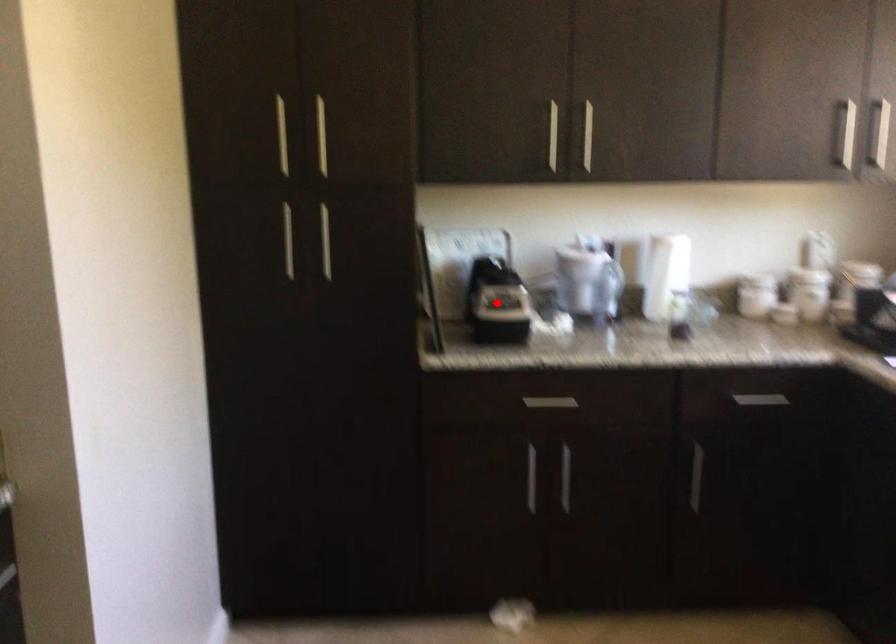
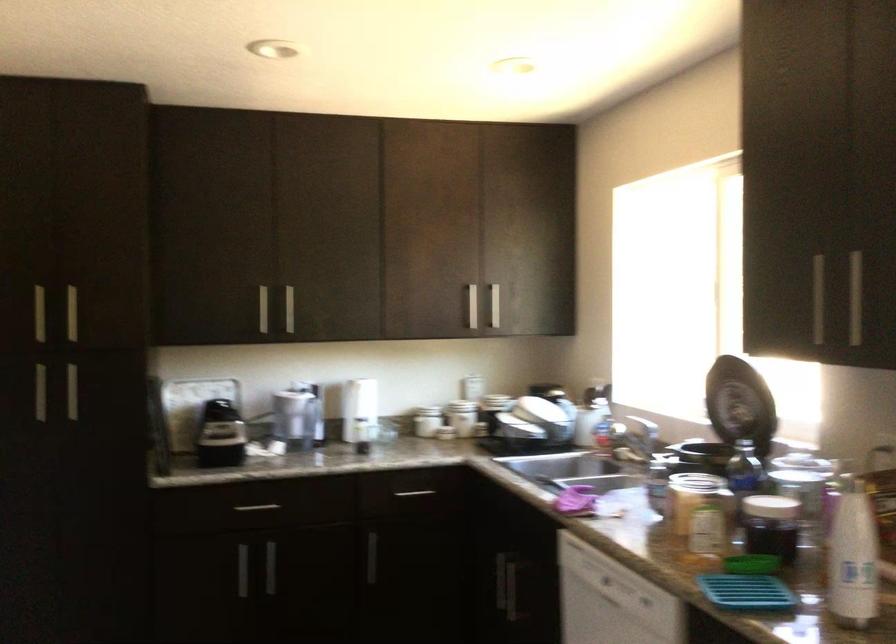
Locate, in the second image, the point that corresponds to the highlighted location in the first image.

(220, 435)